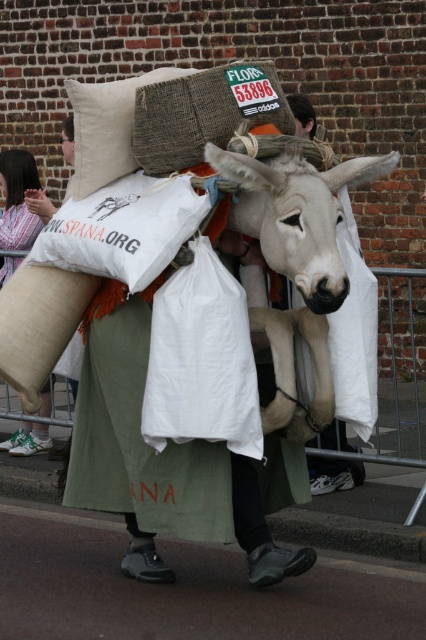
Which is below, white matte donkey at center or beige fabric pillow at upper left?

white matte donkey at center

Find the location of a particular element. The height and width of the screenshot is (640, 426). white matte donkey at center is located at coordinates (296, 214).

The width and height of the screenshot is (426, 640). Describe the element at coordinates (296, 214) in the screenshot. I see `white matte donkey at center` at that location.

The height and width of the screenshot is (640, 426). In order to click on white matte donkey at center in this screenshot , I will do `click(296, 214)`.